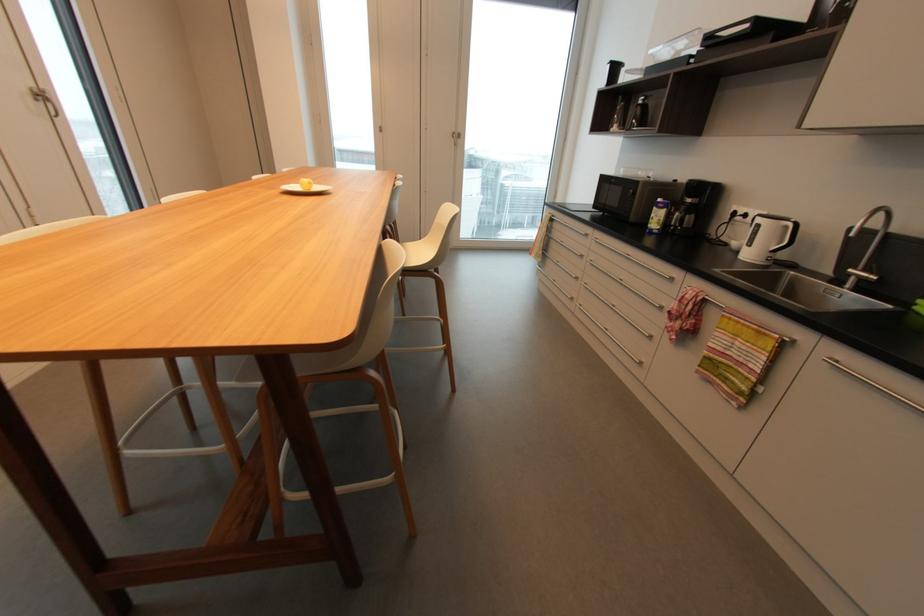
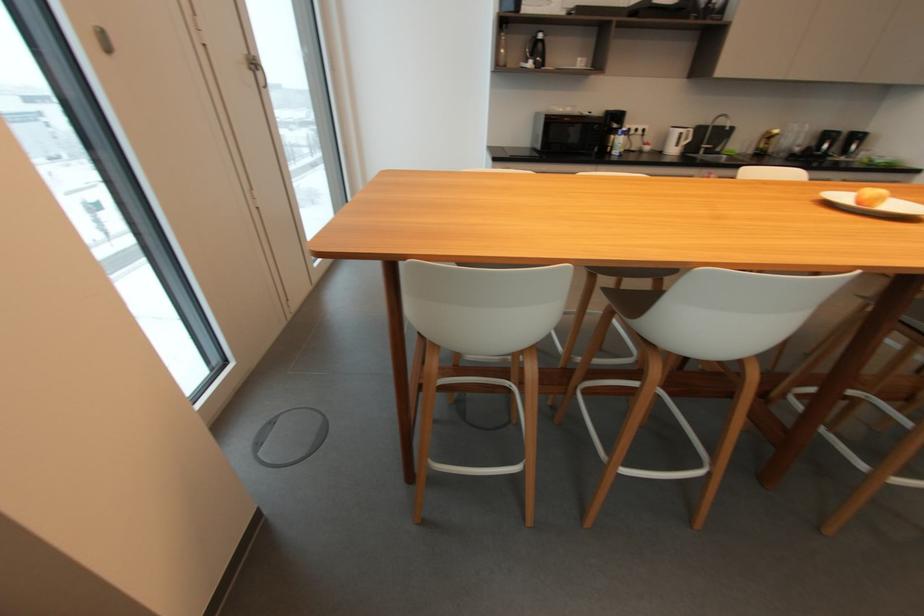
Find the pixel in the second image that matches point 645,100 in the first image.

(544, 36)